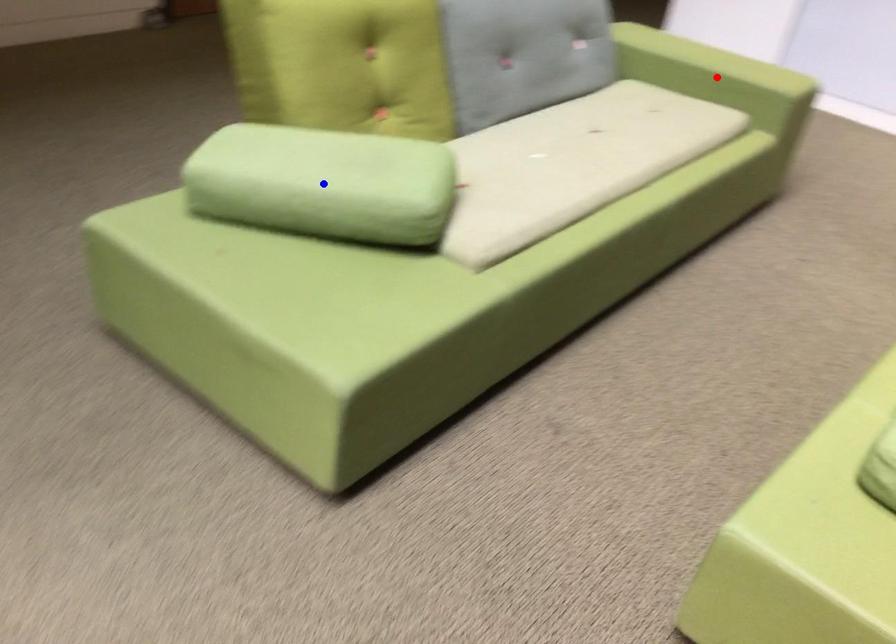
Question: In the image, two points are highlighted. Which point is nearer to the camera? Reply with the corresponding letter.

Choices:
 (A) blue point
 (B) red point

Answer: (A)